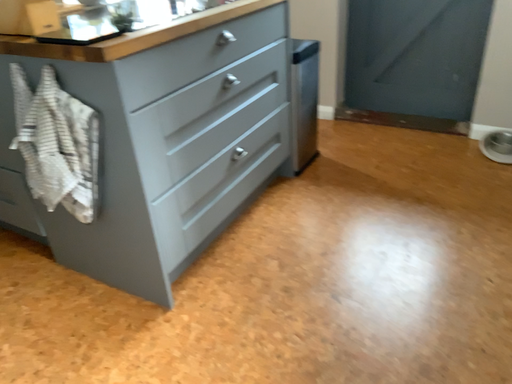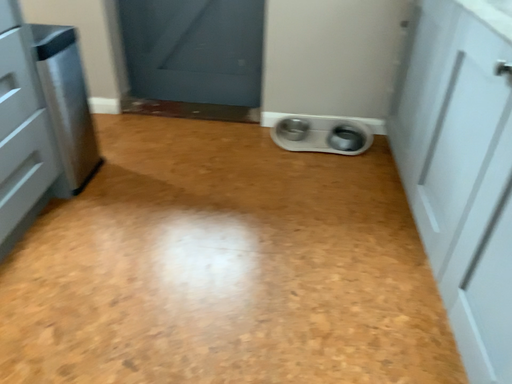
Question: Which way did the camera rotate in the video?

Choices:
 (A) rotated right
 (B) rotated left

Answer: (A)